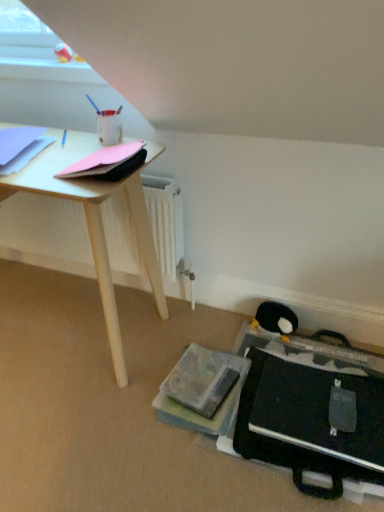
Where is `free space in front of black plush penguin at lower right`? The width and height of the screenshot is (384, 512). free space in front of black plush penguin at lower right is located at coordinates (289, 349).